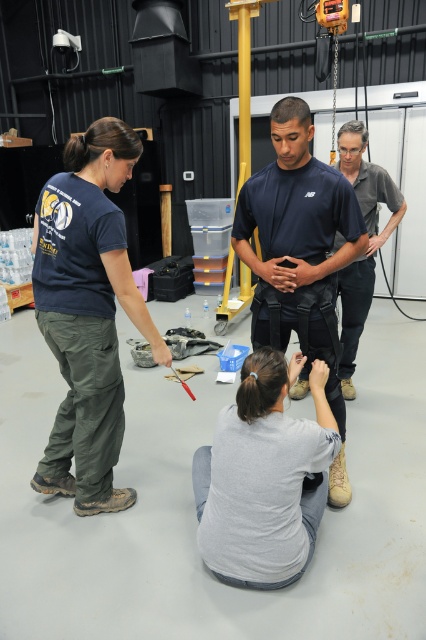
Question: Among these objects, which one is nearest to the camera?

Choices:
 (A) gray cotton shirt at upper right
 (B) gray cotton shirt at lower center
 (C) dark blue fabric shirt at center
 (D) dark green cargo pants at left

Answer: (B)

Question: Based on their relative distances, which object is farther from the gray cotton shirt at upper right?

Choices:
 (A) dark green cargo pants at left
 (B) dark blue fabric shirt at center
 (C) gray cotton shirt at lower center

Answer: (A)

Question: Which object is the closest to the gray cotton shirt at upper right?

Choices:
 (A) dark green cargo pants at left
 (B) gray cotton shirt at lower center
 (C) dark blue fabric shirt at center

Answer: (C)

Question: Does gray cotton shirt at lower center have a smaller size compared to gray cotton shirt at upper right?

Choices:
 (A) yes
 (B) no

Answer: (A)

Question: Observing the image, what is the correct spatial positioning of dark green cargo pants at left in reference to gray cotton shirt at lower center?

Choices:
 (A) above
 (B) below

Answer: (A)

Question: Can you confirm if dark green cargo pants at left is bigger than dark blue fabric shirt at center?

Choices:
 (A) yes
 (B) no

Answer: (A)